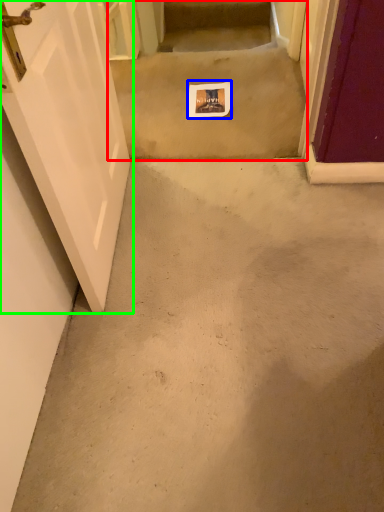
Question: Considering the real-world distances, which object is farthest from stairwell (highlighted by a red box)? postcard (highlighted by a blue box) or door (highlighted by a green box)?

Choices:
 (A) postcard
 (B) door

Answer: (B)